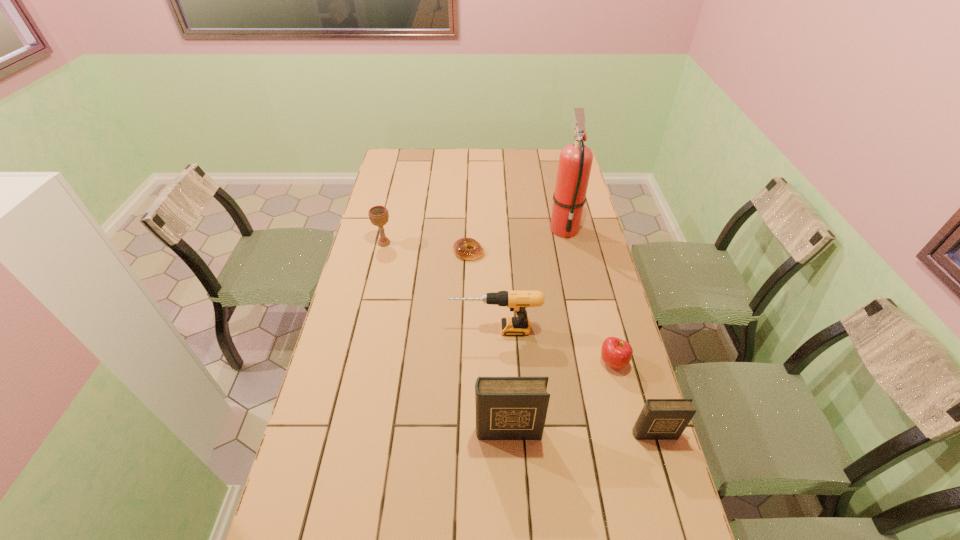
Where is `vacant area that lies between the second tallest object and the bagel`? Image resolution: width=960 pixels, height=540 pixels. vacant area that lies between the second tallest object and the bagel is located at coordinates (489, 341).

Identify the location of empty location between the third nearest object and the shorter diary. This screenshot has width=960, height=540. (634, 398).

The height and width of the screenshot is (540, 960). Find the location of `free space between the apple and the right diary`. free space between the apple and the right diary is located at coordinates (634, 398).

This screenshot has width=960, height=540. I want to click on vacant point located between the drill and the third nearest object, so 554,346.

Identify the location of vacant point located between the shorter diary and the tallest object. This screenshot has height=540, width=960. (610, 331).

This screenshot has width=960, height=540. Find the location of `vacant area that lies between the bagel and the right diary`. vacant area that lies between the bagel and the right diary is located at coordinates (562, 343).

Locate an element on the screen. This screenshot has width=960, height=540. free spot between the fourth nearest object and the tallest object is located at coordinates coord(530,279).

Identify which object is the closest to the chalice. Please provide its 2D coordinates. Your answer should be formatted as a tuple, i.e. [(x, y)], where the tuple contains the x and y coordinates of a point satisfying the conditions above.

[(460, 246)]

Image resolution: width=960 pixels, height=540 pixels. Find the location of `the closest object to the drill`. the closest object to the drill is located at coordinates (616, 353).

In order to click on vacant space that satisfies the following two spatial constraints: 1. on the front side of the shortest object; 2. on the right side of the fifth farthest object in this screenshot , I will do `click(466, 362)`.